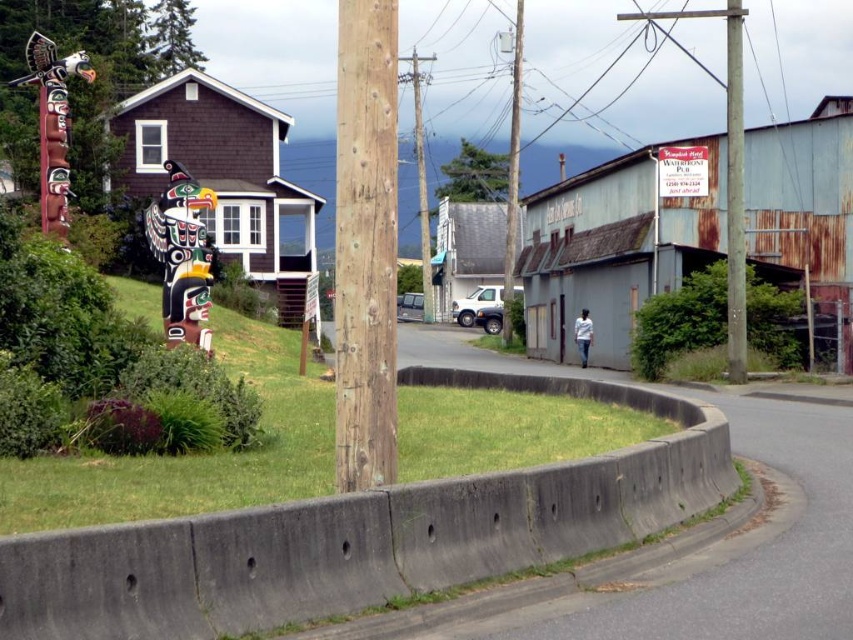
Question: Which point is farther from the camera taking this photo?

Choices:
 (A) (393, 481)
 (B) (509, 161)
 (C) (418, 189)
 (D) (53, 84)

Answer: (C)

Question: Which is nearer to the polished wood totem pole at upper left?

Choices:
 (A) smooth wooden telegraph pole at center
 (B) smooth wooden pole at center
 (C) rustic wooden totem pole at center
 (D) brown rough wood at center

Answer: (D)

Question: Does rustic wooden totem pole at center appear under smooth wooden pole at center?

Choices:
 (A) yes
 (B) no

Answer: (B)

Question: Estimate the real-world distances between objects in this image. Which object is farther from the rustic wooden totem pole at center?

Choices:
 (A) smooth wooden pole at center
 (B) polished wood totem pole at upper left
 (C) brown rough wood at center

Answer: (C)

Question: Observing the image, what is the correct spatial positioning of smooth wooden pole at center in reference to smooth wooden telegraph pole at center?

Choices:
 (A) left
 (B) right

Answer: (B)

Question: Does smooth wooden pole at center appear on the left side of smooth wooden telegraph pole at center?

Choices:
 (A) no
 (B) yes

Answer: (A)